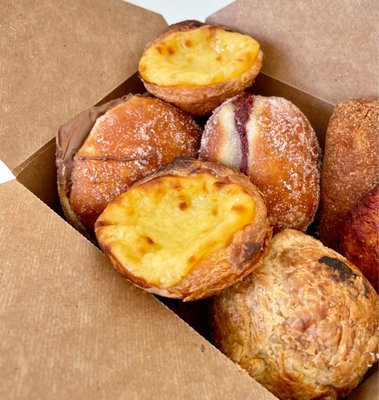
You are a GUI agent. You are given a task and a screenshot of the screen. Output one action in this format:
    pyautogui.click(x=<x>, y=<y>)
    Task: Click on the box
    This screenshot has height=400, width=379.
    Given the screenshot: What is the action you would take?
    pyautogui.click(x=136, y=306)